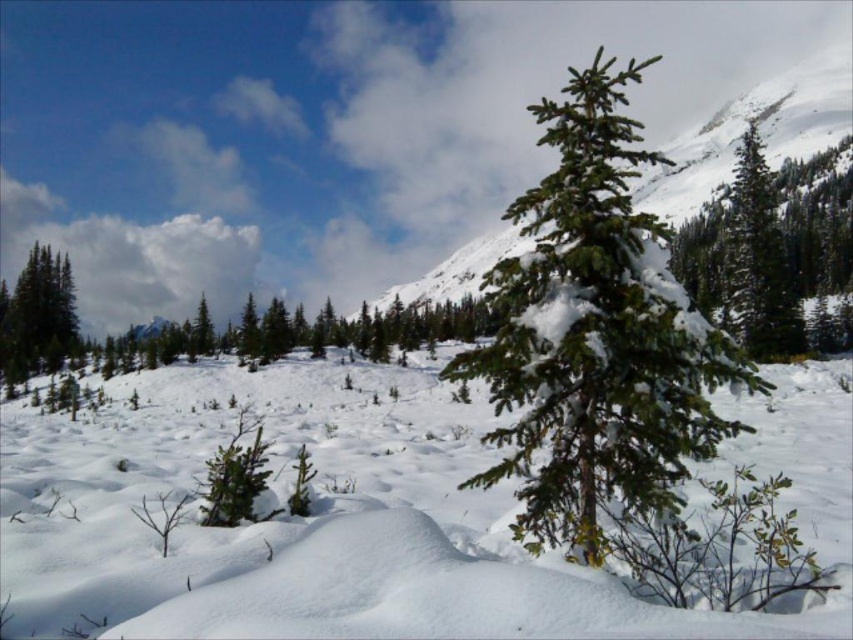
How far apart are white fluffy snow at center and green needle-like tree at upper right?

The distance of white fluffy snow at center from green needle-like tree at upper right is 81.80 meters.

Which is in front, point (320, 518) or point (694, 227)?

Point (320, 518) is in front.

Where is `white fluffy snow at center`? This screenshot has width=853, height=640. white fluffy snow at center is located at coordinates (305, 522).

Does white fluffy snow at center appear under green matte evergreen tree at left?

Correct, white fluffy snow at center is located below green matte evergreen tree at left.

Describe the element at coordinates (305, 522) in the screenshot. Image resolution: width=853 pixels, height=640 pixels. I see `white fluffy snow at center` at that location.

Locate an element on the screen. white fluffy snow at center is located at coordinates (305, 522).

Is point (595, 416) positioned before point (18, 348)?

Yes.

The width and height of the screenshot is (853, 640). Find the location of `green needle-like tree at center`. green needle-like tree at center is located at coordinates (596, 333).